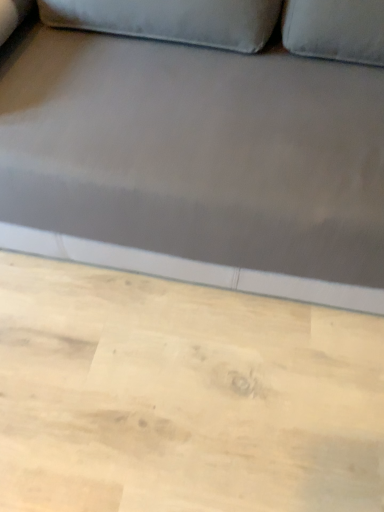
Question: From a real-world perspective, is satin gray fabric couch at center physically located above or below light wood plywood at lower center?

Choices:
 (A) above
 (B) below

Answer: (A)

Question: Does point (71, 78) appear closer or farther from the camera than point (119, 502)?

Choices:
 (A) farther
 (B) closer

Answer: (A)

Question: From the image's perspective, relative to light wood plywood at lower center, is satin gray fabric couch at center above or below?

Choices:
 (A) above
 (B) below

Answer: (A)

Question: Relative to satin gray fabric couch at center, is light wood plywood at lower center in front or behind?

Choices:
 (A) front
 (B) behind

Answer: (B)

Question: Choose the correct answer: Is light wood plywood at lower center inside satin gray fabric couch at center or outside it?

Choices:
 (A) outside
 (B) inside

Answer: (A)

Question: Looking at the image, does light wood plywood at lower center seem bigger or smaller compared to satin gray fabric couch at center?

Choices:
 (A) small
 (B) big

Answer: (A)

Question: Based on their positions, is light wood plywood at lower center located to the left or right of satin gray fabric couch at center?

Choices:
 (A) left
 (B) right

Answer: (A)